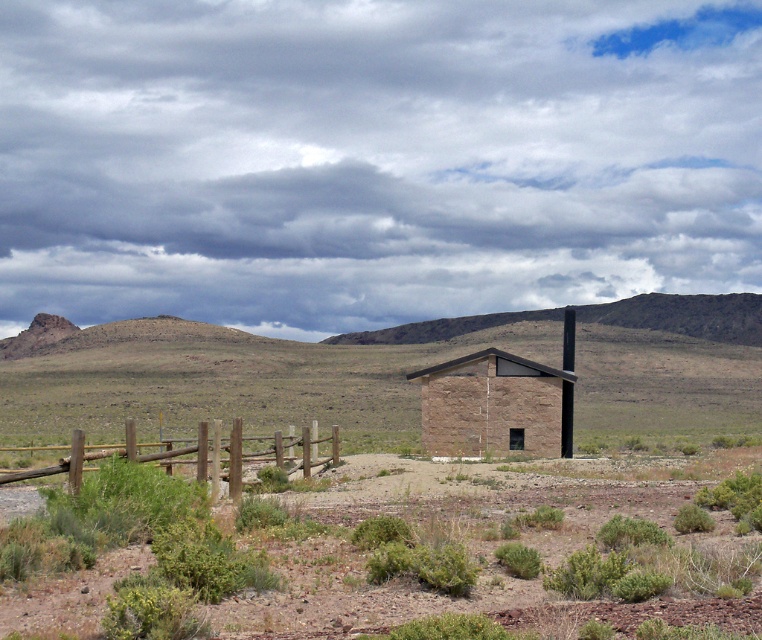
You are a traveler in this desert area and need to find shelter from an approaching sandstorm. You see a brown stone hut at center and a brown wooden fence at lower left. Which structure is more suitable for shelter based on their sizes?

The brown stone hut at center has a smaller size compared to the brown wooden fence at lower left, so the brown wooden fence at lower left is larger and more suitable for shelter.

You are standing in front of the rustic structure and want to determine which of the two points, point (210, 577) or point (267, 436), is closer to you. Based on the coordinates provided, which point is nearer?

Point (210, 577) is closer to the viewer than point (267, 436).

You are standing at the entrance of the structure and want to plant a new shrub exactly 1 meter to the north of the green shrubbery at center. Given the coordinates provided, can you determine the new coordinates for the planting location?

The new coordinates would be approximately 0.866 for the x and 0.492 plus 1 meter in the y direction, but since the coordinate system isnnt specified, we can assume the y increases northward. Thus, the new coordinates are approximately (761,554).